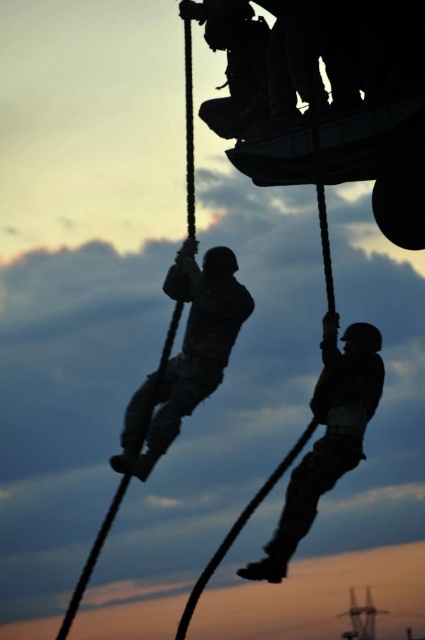
Question: Observing the image, what is the correct spatial positioning of silhouette uniform at center in reference to camouflage fabric soldier at right?

Choices:
 (A) above
 (B) below

Answer: (A)

Question: Which point appears closest to the camera in this image?

Choices:
 (A) (x=212, y=356)
 (B) (x=283, y=541)

Answer: (B)

Question: Is silhouette uniform at center to the right of camouflage fabric soldier at right from the viewer's perspective?

Choices:
 (A) no
 (B) yes

Answer: (A)

Question: Which point is closer to the camera taking this photo?

Choices:
 (A) (246, 307)
 (B) (345, 371)

Answer: (B)

Question: Where is silhouette uniform at center located in relation to camouflage fabric soldier at right in the image?

Choices:
 (A) above
 (B) below

Answer: (A)